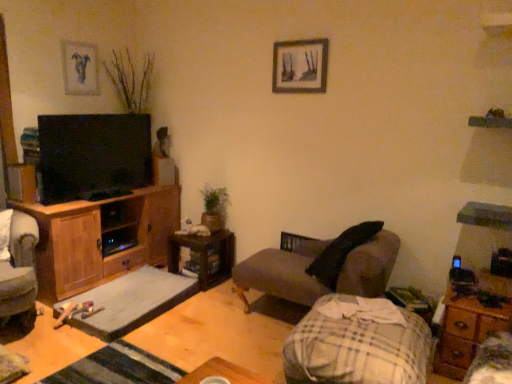
Question: Looking at their shapes, would you say wooden cabinet at left is wider or thinner than wooden nightstand at lower right?

Choices:
 (A) thin
 (B) wide

Answer: (B)

Question: Is wooden cabinet at left inside the boundaries of wooden nightstand at lower right, or outside?

Choices:
 (A) outside
 (B) inside

Answer: (A)

Question: Estimate the real-world distances between objects in this image. Which object is farther from the plaid fabric blanket at lower right?

Choices:
 (A) brown wooden side table at center
 (B) wooden picture frame at upper center, the second picture frame in the left-to-right sequence
 (C) green matte plant at center
 (D) wooden nightstand at lower right
 (E) gray fabric footrest at lower center

Answer: (C)

Question: Based on their relative distances, which object is nearer to the wooden nightstand at lower right?

Choices:
 (A) matte blue painting at upper left, the second picture frame viewed from the right
 (B) gray fabric footrest at lower center
 (C) wooden cabinet at left
 (D) dark gray fabric couch at center
 (E) gray fabric armchair at left

Answer: (D)